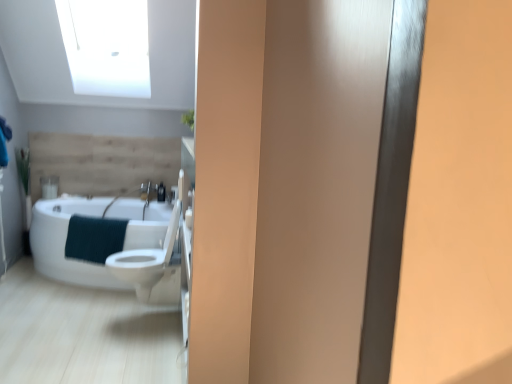
Question: Is white glossy toilet at center completely or partially outside of white glossy bathtub at left?

Choices:
 (A) no
 (B) yes

Answer: (B)

Question: Can you confirm if white glossy toilet at center is taller than white glossy bathtub at left?

Choices:
 (A) yes
 (B) no

Answer: (A)

Question: Considering the relative sizes of white glossy toilet at center and white glossy bathtub at left in the image provided, is white glossy toilet at center smaller than white glossy bathtub at left?

Choices:
 (A) yes
 (B) no

Answer: (A)

Question: From the image's perspective, would you say white glossy toilet at center is shown under white glossy bathtub at left?

Choices:
 (A) yes
 (B) no

Answer: (A)

Question: From a real-world perspective, does white glossy toilet at center sit lower than white glossy bathtub at left?

Choices:
 (A) no
 (B) yes

Answer: (A)

Question: Is white glossy toilet at center thinner than white glossy bathtub at left?

Choices:
 (A) no
 (B) yes

Answer: (B)

Question: Can you confirm if teal textured towel at lower left is taller than matte black soap dispenser at center?

Choices:
 (A) no
 (B) yes

Answer: (B)

Question: From a real-world perspective, is teal textured towel at lower left over matte black soap dispenser at center?

Choices:
 (A) yes
 (B) no

Answer: (B)

Question: Can you confirm if teal textured towel at lower left is shorter than matte black soap dispenser at center?

Choices:
 (A) no
 (B) yes

Answer: (A)

Question: Does teal textured towel at lower left have a smaller size compared to matte black soap dispenser at center?

Choices:
 (A) no
 (B) yes

Answer: (A)

Question: Is teal textured towel at lower left bigger than matte black soap dispenser at center?

Choices:
 (A) yes
 (B) no

Answer: (A)

Question: Is teal textured towel at lower left behind matte black soap dispenser at center?

Choices:
 (A) no
 (B) yes

Answer: (A)

Question: Does white glossy sink at center come behind white glossy bathtub at left?

Choices:
 (A) yes
 (B) no

Answer: (A)